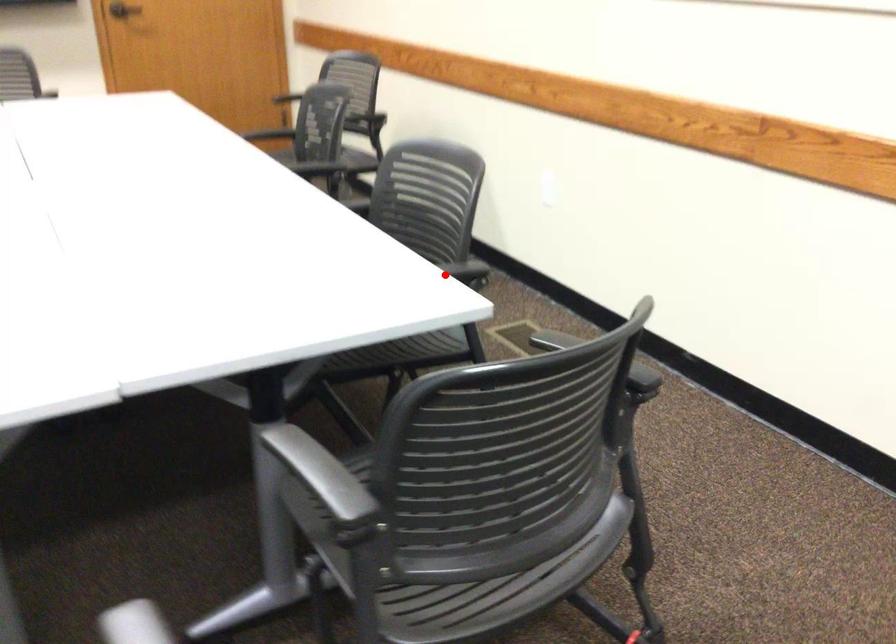
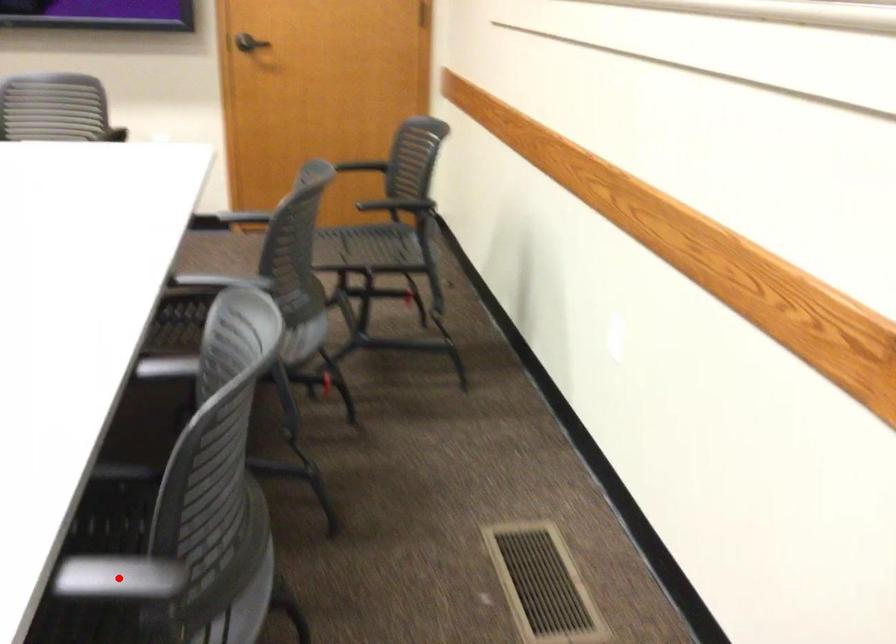
I am providing you with two images of the same scene from different viewpoints. A red point is marked on the first image and another point is marked on the second image. Do the highlighted points in image1 and image2 indicate the same real-world spot?

Yes